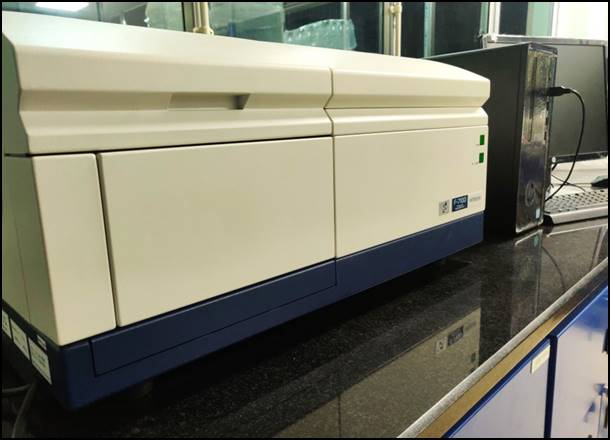
Where is `keyboard`? keyboard is located at coordinates (572, 202).